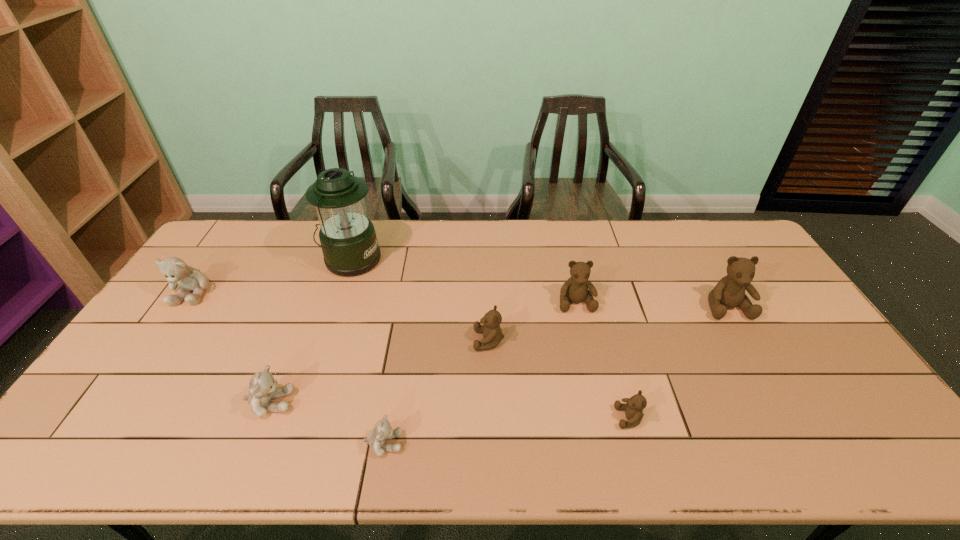
At what (x,y) coordinates should I click in order to perform the action: click on empty space that is in between the rightmost object and the leftmost gray teddy bear. Please return your answer as a coordinate pair (x, y). The height and width of the screenshot is (540, 960). Looking at the image, I should click on (460, 299).

This screenshot has height=540, width=960. I want to click on free space between the lantern and the smallest gray teddy bear, so click(x=368, y=352).

Find the location of a particular element. free space that is in between the fifth farthest object and the second biggest gray teddy bear is located at coordinates (379, 372).

This screenshot has width=960, height=540. What are the coordinates of `object that ranks as the second closest to the leftmost gray teddy bear` in the screenshot? It's located at (263, 388).

Locate which object ranks third in proximity to the leftmost teddy bear. Please provide its 2D coordinates. Your answer should be formatted as a tuple, i.e. [(x, y)], where the tuple contains the x and y coordinates of a point satisfying the conditions above.

[(382, 431)]

Identify which teddy bear is located as the second nearest to the fifth object from right to left. Please provide its 2D coordinates. Your answer should be formatted as a tuple, i.e. [(x, y)], where the tuple contains the x and y coordinates of a point satisfying the conditions above.

[(492, 334)]

I want to click on teddy bear that is the closest to the fifth farthest object, so click(575, 289).

Point out which brown teddy bear is positioned as the nearest to the tallest teddy bear. Please provide its 2D coordinates. Your answer should be formatted as a tuple, i.e. [(x, y)], where the tuple contains the x and y coordinates of a point satisfying the conditions above.

[(575, 289)]

Image resolution: width=960 pixels, height=540 pixels. I want to click on the third closest brown teddy bear to the third smallest brown teddy bear, so click(729, 292).

Point out which gray teddy bear is positioned as the second nearest to the second biggest brown teddy bear. Please provide its 2D coordinates. Your answer should be formatted as a tuple, i.e. [(x, y)], where the tuple contains the x and y coordinates of a point satisfying the conditions above.

[(263, 388)]